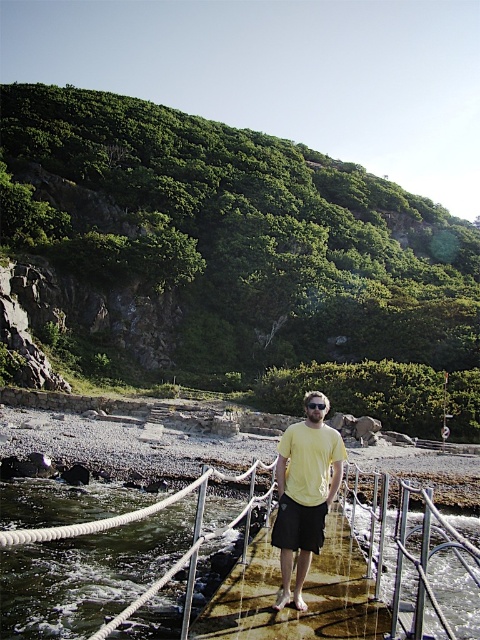
Question: Considering the relative positions of greenish-brown water at center and yellow matte t-shirt at center in the image provided, where is greenish-brown water at center located with respect to yellow matte t-shirt at center?

Choices:
 (A) right
 (B) left

Answer: (B)

Question: Does greenish-brown water at center have a greater width compared to yellow matte t-shirt at center?

Choices:
 (A) no
 (B) yes

Answer: (B)

Question: Is greenish-brown water at center wider than yellow matte t-shirt at center?

Choices:
 (A) yes
 (B) no

Answer: (A)

Question: Which object appears closest to the camera in this image?

Choices:
 (A) greenish-brown water at center
 (B) yellow matte t-shirt at center

Answer: (A)

Question: Among these objects, which one is farthest from the camera?

Choices:
 (A) greenish-brown water at center
 (B) yellow matte t-shirt at center

Answer: (B)

Question: Which of the following is the closest to the observer?

Choices:
 (A) yellow matte t-shirt at center
 (B) greenish-brown water at center

Answer: (B)